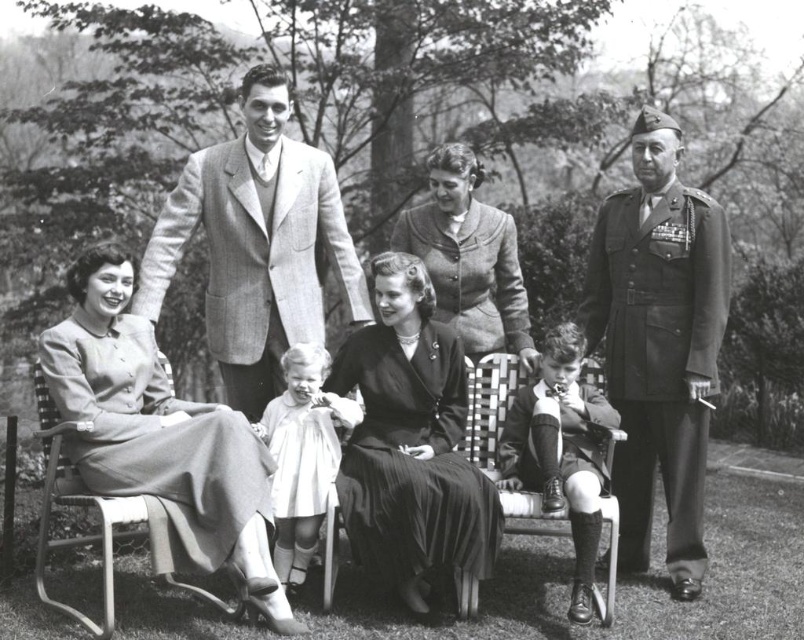
You are a fashion designer analyzing this historical photograph. You notice a point at coordinates (256,243). What object in the image is associated with this coordinate?

The point at coordinates (256,243) corresponds to the smooth wool suit at center.

You are a tailor observing the family gathering in the image. You need to determine which garment requires more fabric for alterations between the smooth wool suit at center and the matte black dress at center. Based on their widths, which one would need more fabric?

The smooth wool suit at center has a greater width than the matte black dress at center, so it would require more fabric for alterations.

You are a tailor observing the family gathering in the photograph. You need to determine which of the two suits, the smooth wool suit at center or the smooth woolen suit at lower center, requires more fabric for alterations. Based on their sizes, which one would need more fabric?

The smooth wool suit at center is bigger than the smooth woolen suit at lower center, so it would require more fabric for alterations.